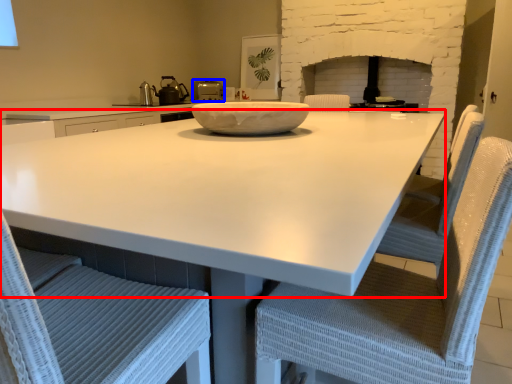
Question: Which object appears farthest to the camera in this image, countertop (highlighted by a red box) or kitchen appliance (highlighted by a blue box)?

Choices:
 (A) countertop
 (B) kitchen appliance

Answer: (B)